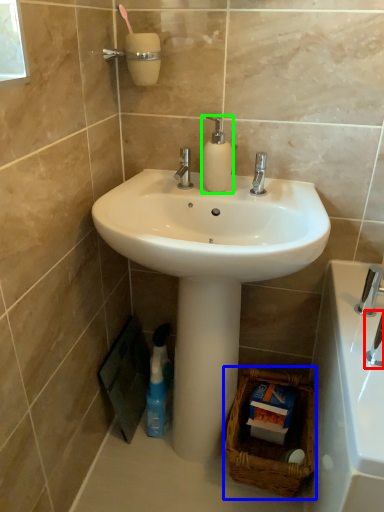
Question: Which is farther away from plumbing fixture (highlighted by a red box)? basket (highlighted by a blue box) or soap dispenser (highlighted by a green box)?

Choices:
 (A) basket
 (B) soap dispenser

Answer: (B)